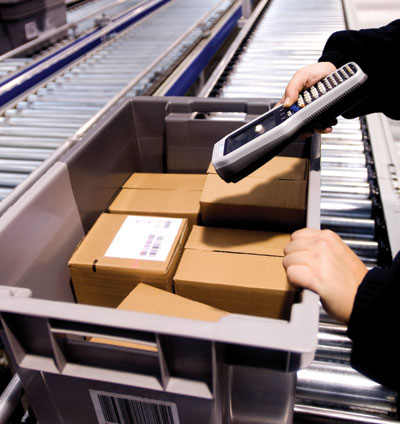
The image size is (400, 424). In order to click on sticker in this screenshot , I will do `click(104, 258)`.